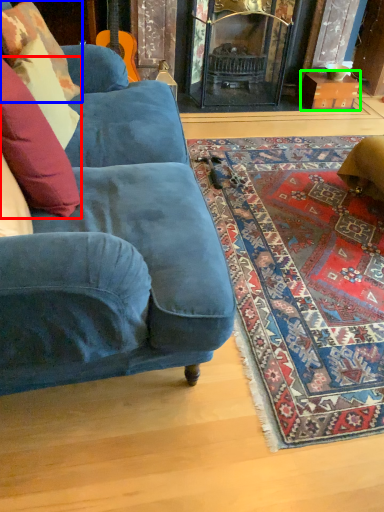
Question: Considering the real-world distances, which object is farthest from pillow (highlighted by a red box)? pillow (highlighted by a blue box) or cardboard box (highlighted by a green box)?

Choices:
 (A) pillow
 (B) cardboard box

Answer: (B)